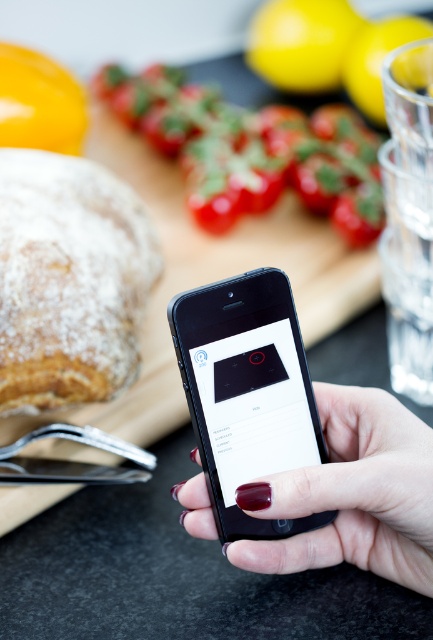
Does point (426, 572) lie in front of point (300, 33)?

Yes, it is in front of point (300, 33).

Can you confirm if nail polish at center is positioned above yellow matte lemon at upper center?

Actually, nail polish at center is below yellow matte lemon at upper center.

Is point (427, 456) positioned before point (328, 84)?

That is True.

Where is `nail polish at center`? nail polish at center is located at coordinates (352, 493).

Is powdery golden bread at left positioned at the back of black matte phone at center?

That is True.

Measure the distance between powdery golden bread at left and black matte phone at center.

powdery golden bread at left and black matte phone at center are 6.17 inches apart.

Describe the element at coordinates (68, 280) in the screenshot. The image size is (433, 640). I see `powdery golden bread at left` at that location.

You are a GUI agent. You are given a task and a screenshot of the screen. Output one action in this format:
    pyautogui.click(x=<x>, y=<y>)
    Task: Click on the powdery golden bread at left
    The height and width of the screenshot is (640, 433).
    Given the screenshot: What is the action you would take?
    pyautogui.click(x=68, y=280)

Based on the photo, can you confirm if powdery golden bread at left is positioned above yellow matte lemon at upper right?

Incorrect, powdery golden bread at left is not positioned above yellow matte lemon at upper right.

In the scene shown: Who is more distant from viewer, (2, 172) or (426, 22)?

The point (426, 22) is more distant.

Who is more forward, (91, 291) or (371, 40)?

Answer: Point (91, 291)

Locate an element on the screen. powdery golden bread at left is located at coordinates (68, 280).